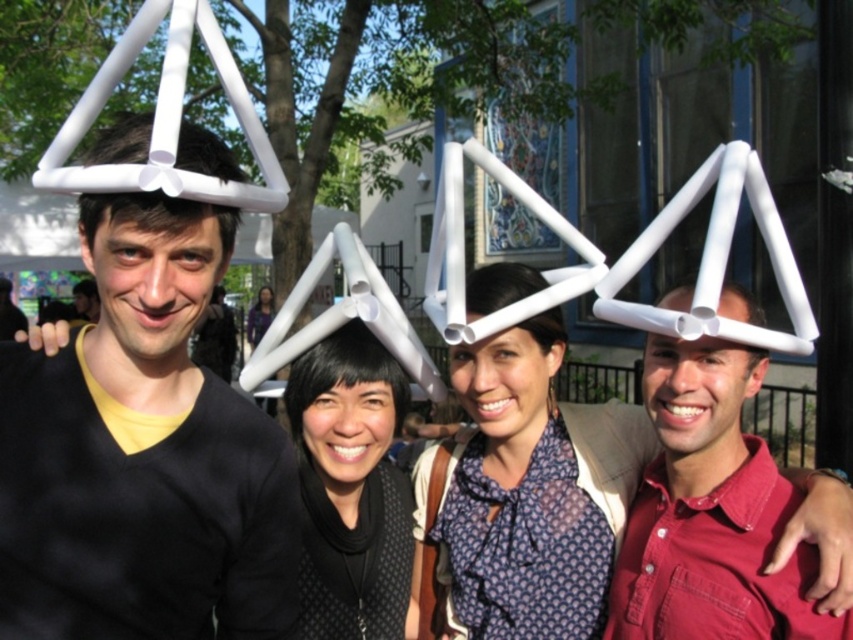
Who is taller, matte black shirt at center or matte black hair at upper left?

matte black shirt at center

Can you confirm if matte black shirt at center is smaller than matte black hair at upper left?

Actually, matte black shirt at center might be larger than matte black hair at upper left.

Is point (258, 314) positioned behind point (91, 312)?

Yes, it is behind point (91, 312).

The image size is (853, 640). What are the coordinates of `matte black shirt at center` in the screenshot? It's located at (259, 316).

Can you confirm if white matte triangle at center is bigger than white matte geometric structure at center?

Incorrect, white matte triangle at center is not larger than white matte geometric structure at center.

Which is in front, point (218, 163) or point (495, 288)?

Point (218, 163) is more forward.

Where is `white matte triangle at center`? white matte triangle at center is located at coordinates (x=155, y=218).

Does matte black sweater at center have a larger size compared to white matte geometric structure at center?

Correct, matte black sweater at center is larger in size than white matte geometric structure at center.

Is matte black sweater at center positioned in front of white matte geometric structure at center?

That is True.

Between point (84, 419) and point (469, 310), which one is positioned behind?

Positioned behind is point (469, 310).

The height and width of the screenshot is (640, 853). What are the coordinates of `matte black sweater at center` in the screenshot? It's located at (143, 456).